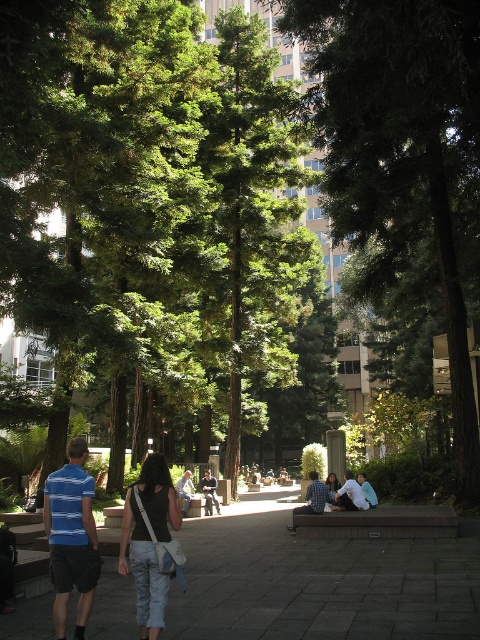
Between green leafy tree at center and light brown wooden bench at center, which one appears on the right side from the viewer's perspective?

From the viewer's perspective, green leafy tree at center appears more on the right side.

Who is higher up, green leafy tree at center or light brown wooden bench at center?

Positioned higher is green leafy tree at center.

Is point (371, 80) positioned in front of point (188, 477)?

Yes, it is.

Where is `green leafy tree at center`? The image size is (480, 640). green leafy tree at center is located at coordinates (400, 147).

Is dark gray fabric jacket at center smaller than denim jacket at center?

Incorrect, dark gray fabric jacket at center is not smaller in size than denim jacket at center.

Identify the location of dark gray fabric jacket at center. (210, 492).

Is point (356, 499) less distant than point (206, 492)?

That is True.

How much distance is there between light blue shirt at lower right and dark gray fabric jacket at center?

A distance of 8.30 meters exists between light blue shirt at lower right and dark gray fabric jacket at center.

This screenshot has height=640, width=480. In order to click on light blue shirt at lower right in this screenshot , I will do `click(350, 493)`.